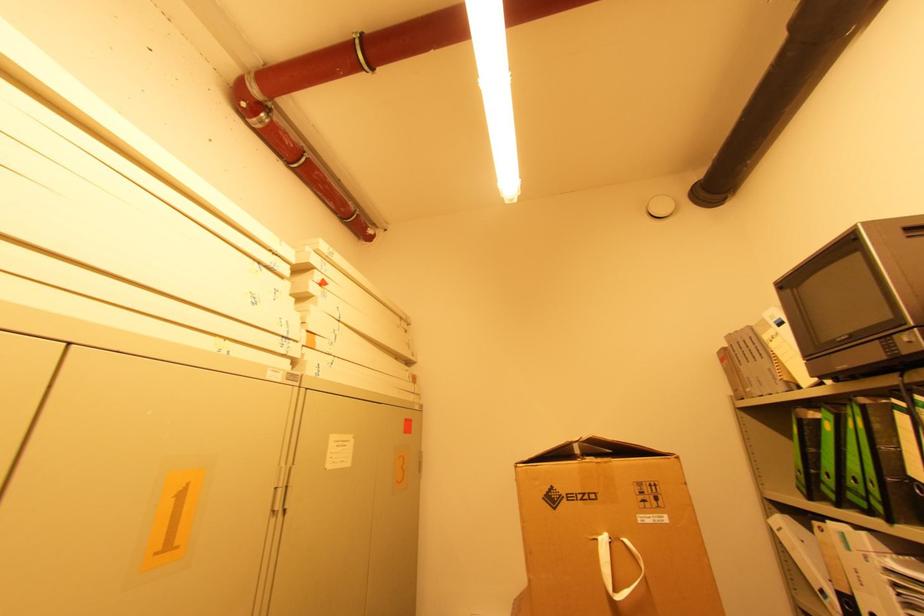
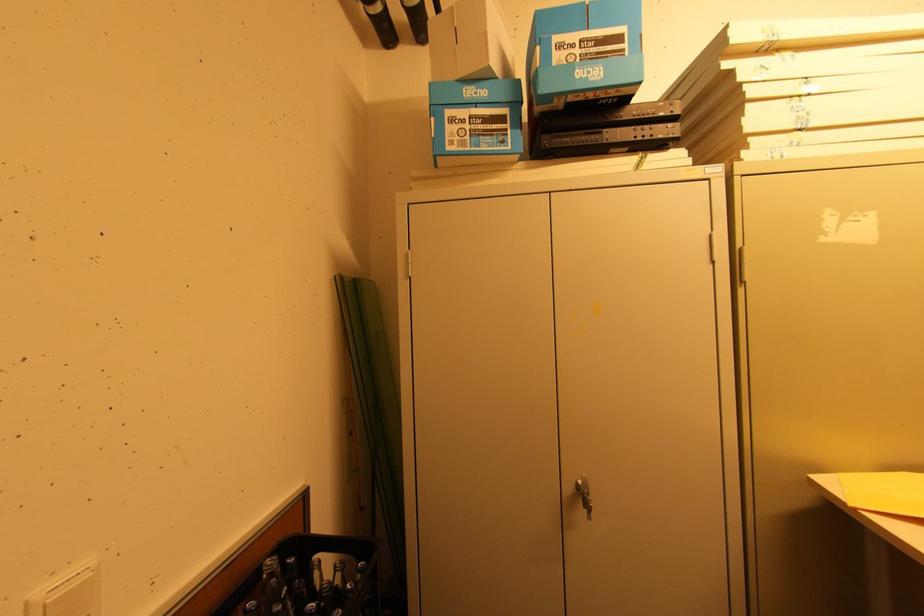
Question: Based on the continuous images, in which direction is the camera rotating? Reply with the corresponding letter.

Choices:
 (A) Left
 (B) Right
 (C) Up
 (D) Down

Answer: (A)